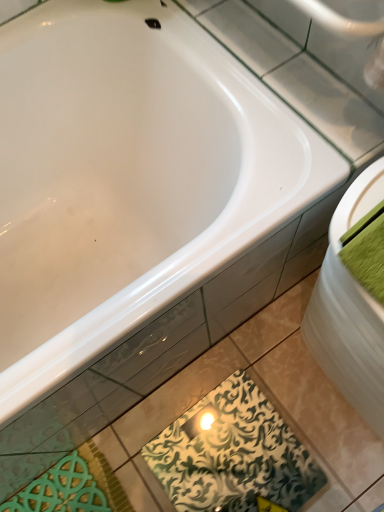
Question: In terms of width, does white glossy sink at right look wider or thinner when compared to green patterned tile at lower center?

Choices:
 (A) thin
 (B) wide

Answer: (A)

Question: Is point (367, 376) positioned closer to the camera than point (291, 439)?

Choices:
 (A) farther
 (B) closer

Answer: (B)

Question: Which object is positioned farthest from the white glossy sink at right?

Choices:
 (A) green fabric towel at right
 (B) green patterned tile at lower center

Answer: (B)

Question: Which is nearer to the white glossy sink at right?

Choices:
 (A) green fabric towel at right
 (B) green patterned tile at lower center

Answer: (A)